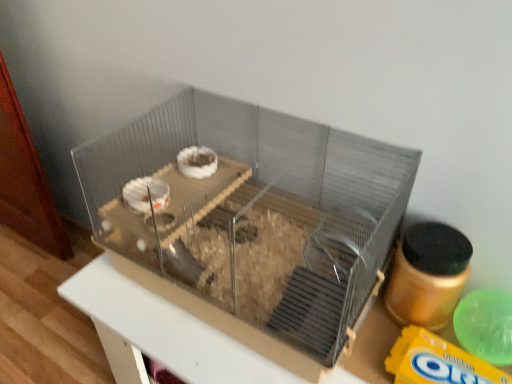
Question: Is clear plastic cage at center positioned far away from metallic gray cage at center?

Choices:
 (A) no
 (B) yes

Answer: (A)

Question: From a real-world perspective, is clear plastic cage at center on metallic gray cage at center?

Choices:
 (A) yes
 (B) no

Answer: (A)

Question: Is clear plastic cage at center positioned in front of metallic gray cage at center?

Choices:
 (A) no
 (B) yes

Answer: (B)

Question: Is clear plastic cage at center taller than metallic gray cage at center?

Choices:
 (A) yes
 (B) no

Answer: (B)

Question: Is clear plastic cage at center facing towards metallic gray cage at center?

Choices:
 (A) yes
 (B) no

Answer: (B)

Question: Can you confirm if clear plastic cage at center is bigger than metallic gray cage at center?

Choices:
 (A) yes
 (B) no

Answer: (B)

Question: Considering the relative sizes of metallic gray cage at center and yellow matte cereal at lower right in the image provided, is metallic gray cage at center taller than yellow matte cereal at lower right?

Choices:
 (A) yes
 (B) no

Answer: (A)

Question: Is metallic gray cage at center not within yellow matte cereal at lower right?

Choices:
 (A) yes
 (B) no

Answer: (A)

Question: Can you confirm if metallic gray cage at center is thinner than yellow matte cereal at lower right?

Choices:
 (A) yes
 (B) no

Answer: (B)

Question: Does metallic gray cage at center lie behind yellow matte cereal at lower right?

Choices:
 (A) no
 (B) yes

Answer: (A)

Question: From the image's perspective, is metallic gray cage at center under yellow matte cereal at lower right?

Choices:
 (A) yes
 (B) no

Answer: (A)

Question: Is metallic gray cage at center bigger than yellow matte cereal at lower right?

Choices:
 (A) yes
 (B) no

Answer: (A)

Question: From the image's perspective, is yellow matte cereal at lower right over clear plastic cage at center?

Choices:
 (A) no
 (B) yes

Answer: (A)